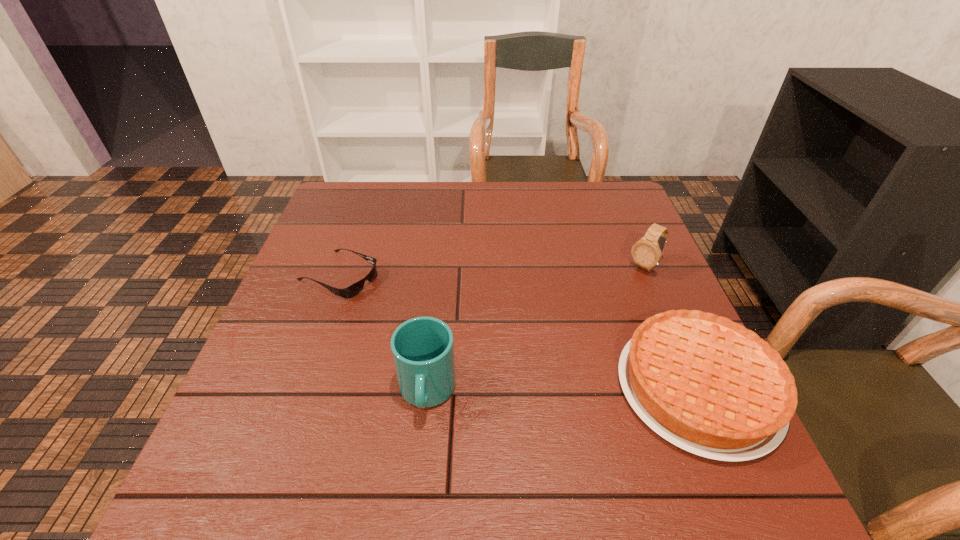
Image resolution: width=960 pixels, height=540 pixels. I want to click on free spot on the desktop that is between the second object from left to right and the third tallest object and is positioned on the face of the watch, so click(x=524, y=391).

Identify the location of vacant spot on the desktop that is between the cup and the third tallest object and is positioned on the front-facing side of the sunglasses. (597, 390).